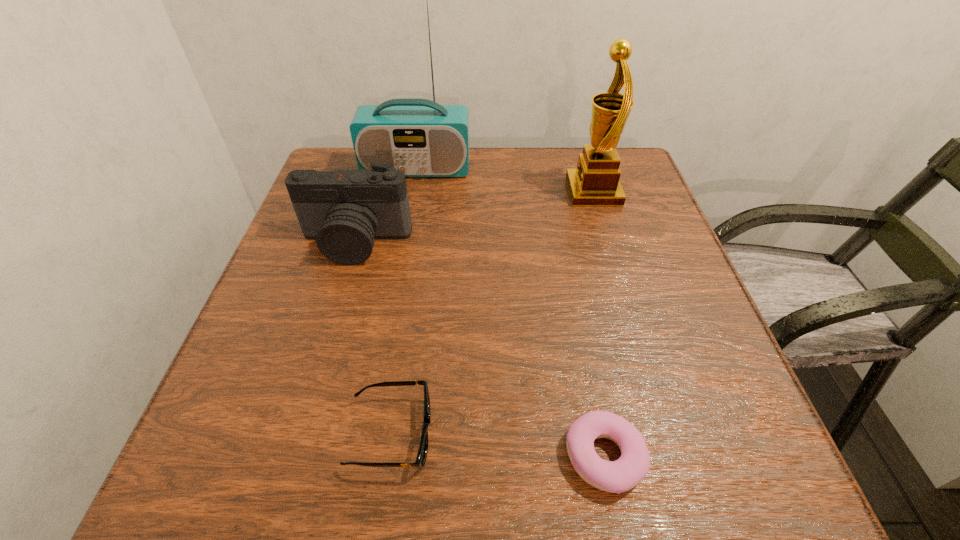
The width and height of the screenshot is (960, 540). I want to click on object that is at the far left corner, so click(x=422, y=138).

Locate an element on the screen. object that is at the far right corner is located at coordinates (595, 182).

The height and width of the screenshot is (540, 960). Find the location of `vacant point at the far edge`. vacant point at the far edge is located at coordinates (423, 193).

The height and width of the screenshot is (540, 960). What are the coordinates of `free space at the near edge of the desktop` in the screenshot? It's located at (388, 463).

Identify the location of blank space at the right edge. This screenshot has height=540, width=960. (656, 239).

Where is `free spot between the award and the pastry`? The image size is (960, 540). free spot between the award and the pastry is located at coordinates (599, 324).

Locate an element on the screen. free space between the sunglasses and the fourth shortest object is located at coordinates (492, 313).

Locate an element on the screen. Image resolution: width=960 pixels, height=540 pixels. free area in between the radio receiver and the sunglasses is located at coordinates (404, 301).

What are the coordinates of `free point between the award and the third farthest object` in the screenshot? It's located at (474, 217).

Locate an element on the screen. Image resolution: width=960 pixels, height=540 pixels. vacant space that is in between the fourth shortest object and the sunglasses is located at coordinates (492, 313).